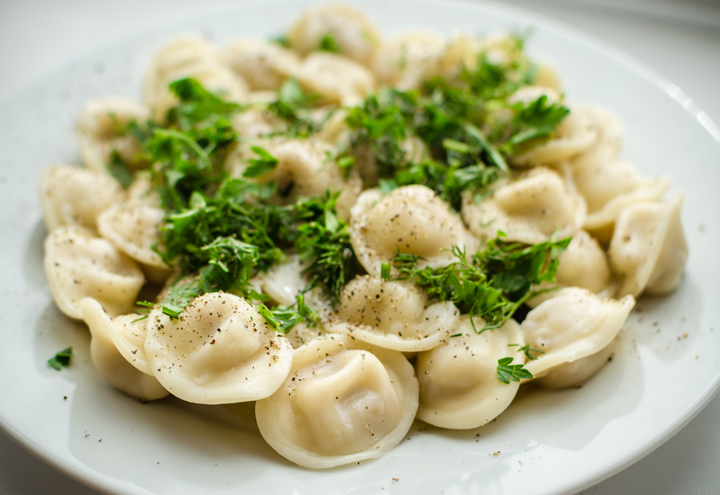
This screenshot has width=720, height=495. What are the coordinates of `white plate` in the screenshot? It's located at (621, 402).